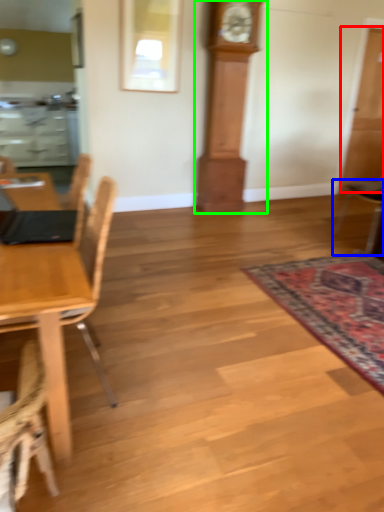
Question: Which object is positioned closest to glass door (highlighted by a red box)? Select from chair (highlighted by a blue box) and clock (highlighted by a green box).

Choices:
 (A) chair
 (B) clock

Answer: (A)